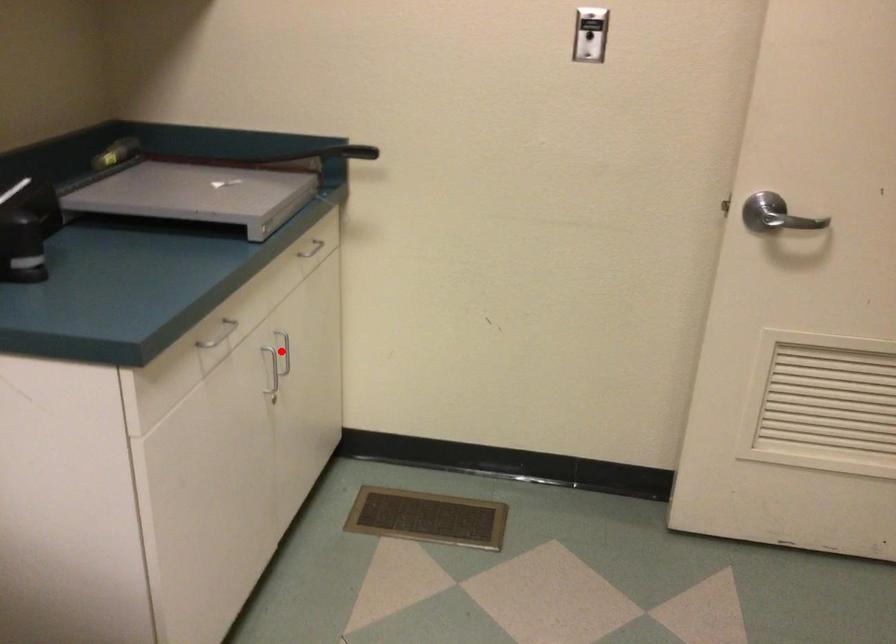
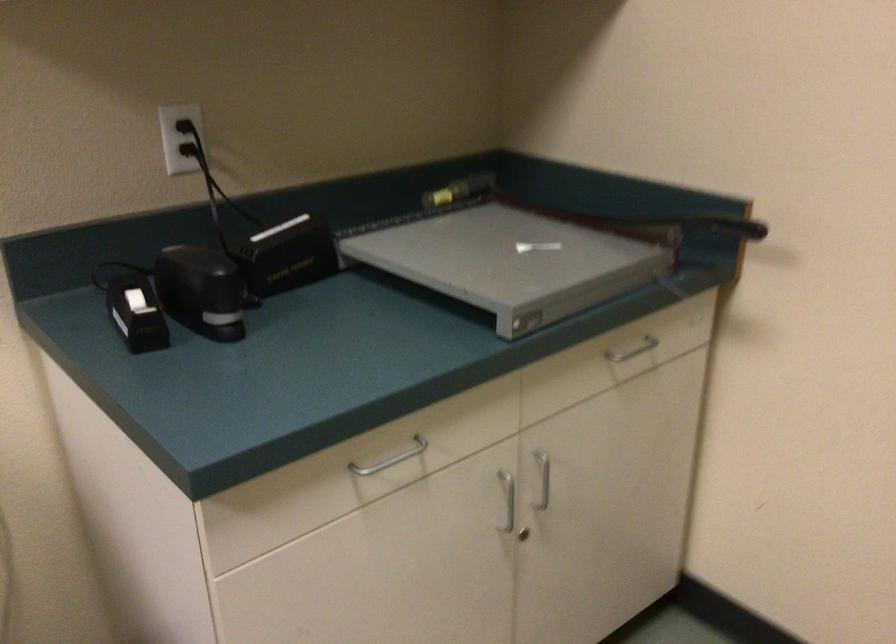
Question: I am providing you with two images of the same scene from different viewpoints. Image1 has a red point marked. In image2, the corresponding 3D location appears at what relative position? Reply with the corresponding letter.

Choices:
 (A) Closer
 (B) Farther

Answer: (A)